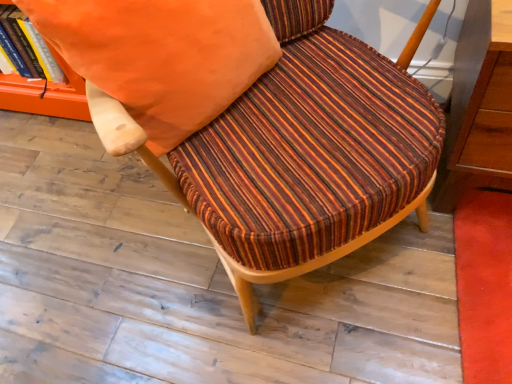
At what (x,y) coordinates should I click in order to perform the action: click on vacant space situated on the left part of striped fabric chair at center. Please return your answer as a coordinate pair (x, y). The image size is (512, 384). Looking at the image, I should click on (84, 243).